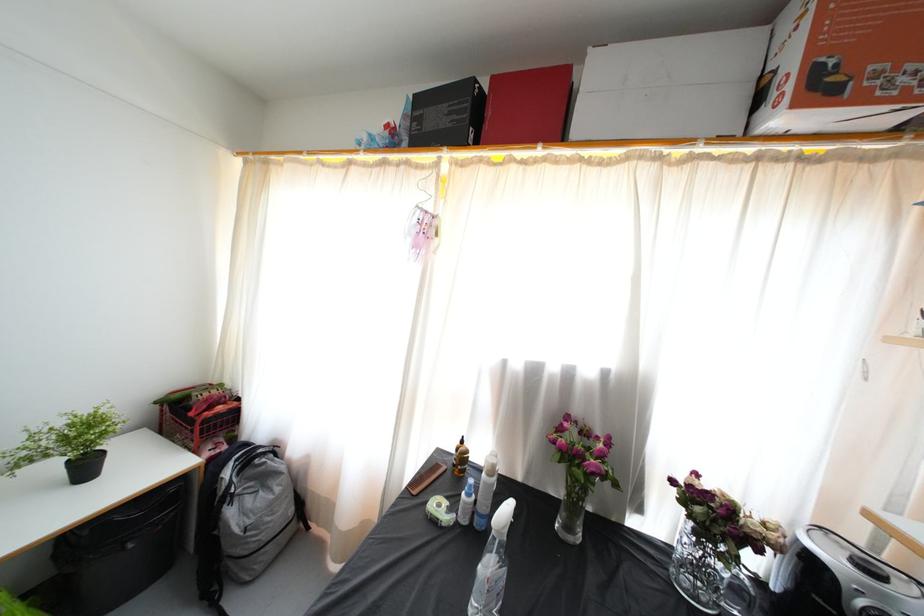
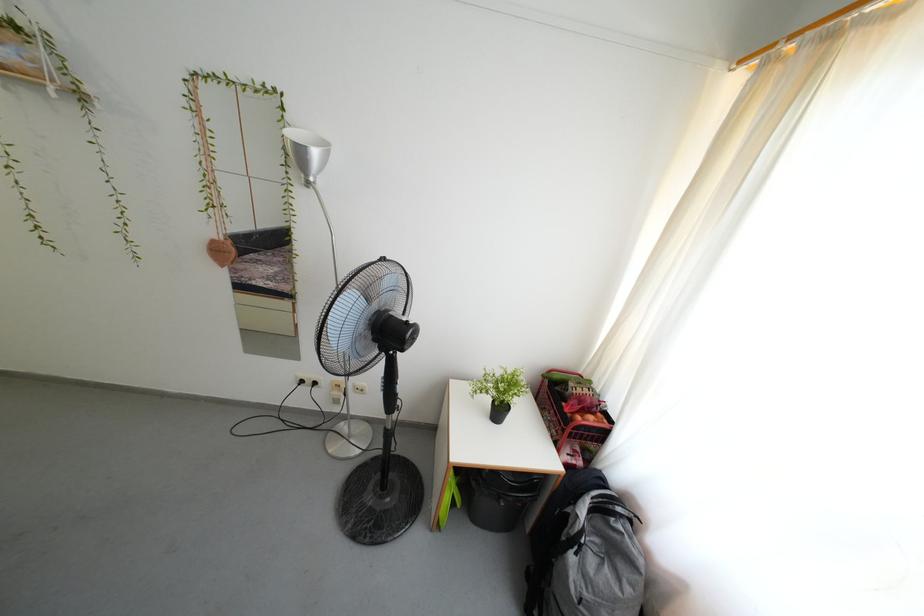
Question: The camera is either moving clockwise (left) or counter-clockwise (right) around the object. The first image is from the beginning of the video and the second image is from the end. Is the camera moving left or right when shooting the video?

Choices:
 (A) Left
 (B) Right

Answer: (B)